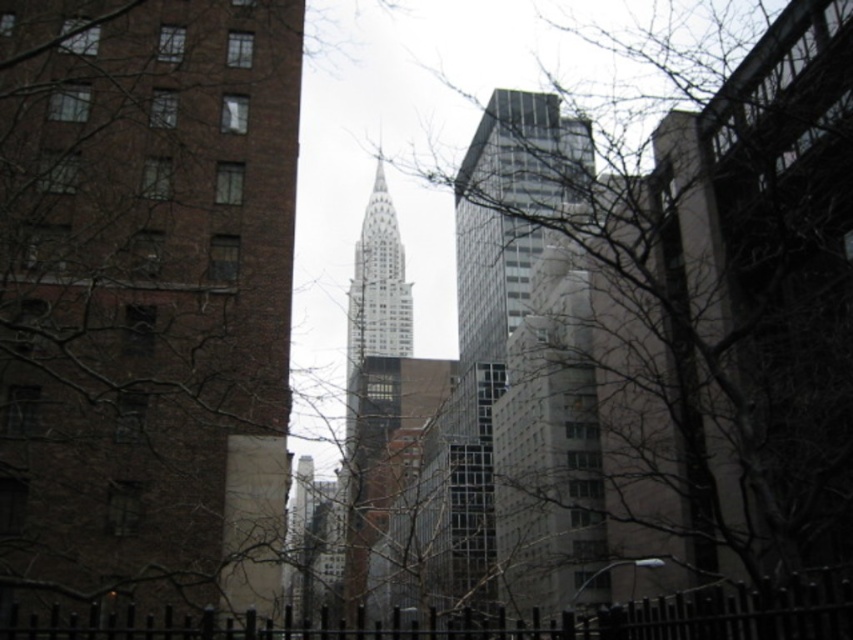
Can you confirm if glassy steel skyscraper at center is bigger than white glass tower at center?

Actually, glassy steel skyscraper at center might be smaller than white glass tower at center.

Between glassy steel skyscraper at center and white glass tower at center, which one has more height?

With more height is white glass tower at center.

Which is behind, point (529, 209) or point (363, 262)?

The point (363, 262) is behind.

I want to click on glassy steel skyscraper at center, so click(519, 365).

From the picture: Can you confirm if bare branches at center is wider than white glass tower at center?

Indeed, bare branches at center has a greater width compared to white glass tower at center.

At what (x,y) coordinates should I click in order to perform the action: click on bare branches at center. Please return your answer as a coordinate pair (x, y). The width and height of the screenshot is (853, 640). Looking at the image, I should click on (641, 353).

This screenshot has height=640, width=853. In order to click on bare branches at center in this screenshot , I will do `click(641, 353)`.

I want to click on bare branches at center, so click(641, 353).

In the scene shown: Is bare branches at center in front of glassy steel skyscraper at center?

Yes, bare branches at center is closer to the viewer.

Does point (515, 289) come farther from viewer compared to point (582, 560)?

Yes.

What do you see at coordinates (641, 353) in the screenshot?
I see `bare branches at center` at bounding box center [641, 353].

Locate an element on the screen. Image resolution: width=853 pixels, height=640 pixels. bare branches at center is located at coordinates (641, 353).